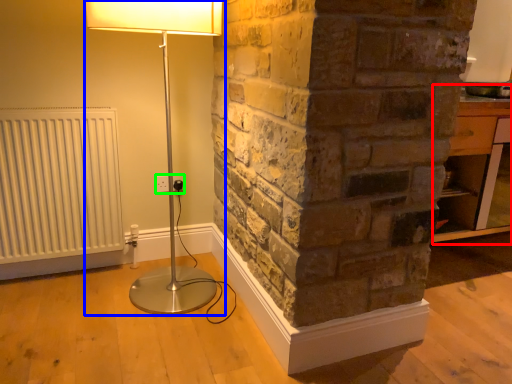
Question: Which object is the farthest from table (highlighted by a red box)? Choose among these: lamp (highlighted by a blue box) or electric outlet (highlighted by a green box).

Choices:
 (A) lamp
 (B) electric outlet

Answer: (B)